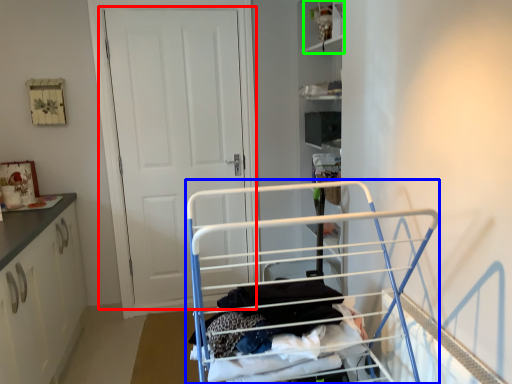
Question: Estimate the real-world distances between objects in this image. Which object is closer to door (highlighted by a red box), baby carriage (highlighted by a blue box) or cabinet (highlighted by a green box)?

Choices:
 (A) baby carriage
 (B) cabinet

Answer: (B)